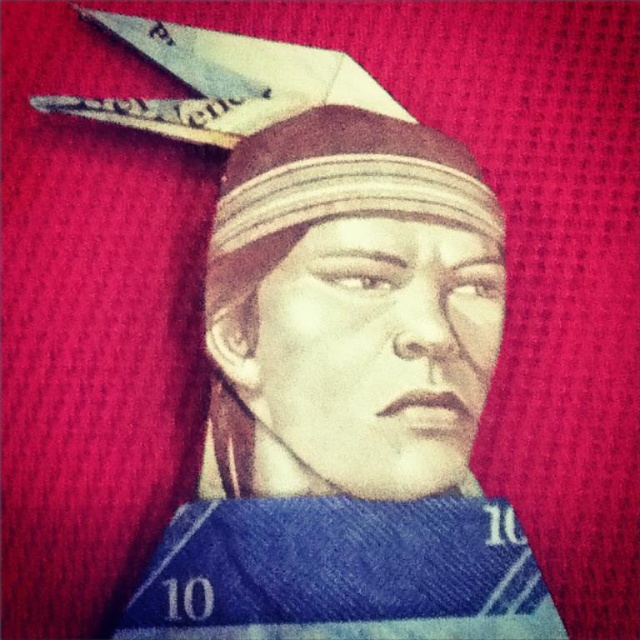
You are an art conservator examining the portrait. You notice two points of concern on the surface of the artwork. The first point is at coordinates point (244, 246), and the second is at point (211, 51). Which of these points is nearer to the viewer?

Point (244, 246) is closer to the viewer than point (211, 51).

You are an artist trying to cut out the smooth paper head at center from the image. The metallic silver scissors at upper center are your only tool. Can you reach the head with the scissors without moving them?

The smooth paper head at center is to the right of the metallic silver scissors at upper center, so yes, you can reach the head with the scissors without moving them since the scissors are positioned to the left of the head.

Based on the photo, you are an art conservator examining a portrait. You need to locate the smooth paper head at center. Where exactly is it positioned in the image?

The smooth paper head at center is positioned at point coordinates of (349, 310).